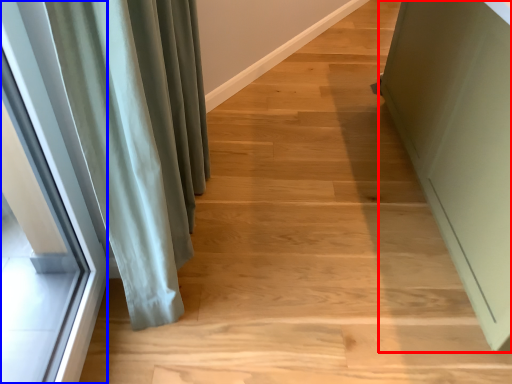
Question: Which object appears farthest to the camera in this image, screen door (highlighted by a red box) or window (highlighted by a blue box)?

Choices:
 (A) screen door
 (B) window

Answer: (A)